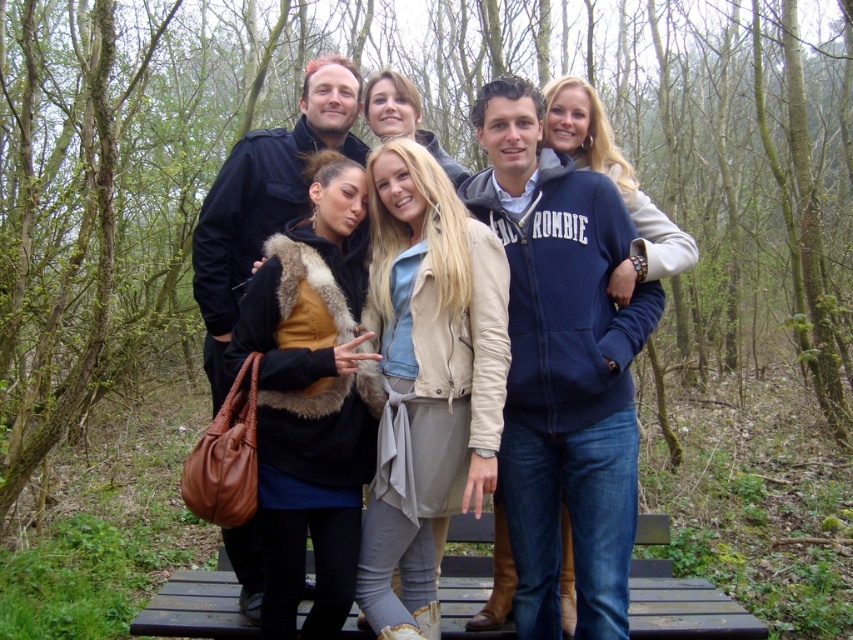
Question: Which point is closer to the camera taking this photo?

Choices:
 (A) (192, 588)
 (B) (292, 131)

Answer: (A)

Question: Does matte black jacket at center have a smaller size compared to black wood bench at center?

Choices:
 (A) yes
 (B) no

Answer: (B)

Question: Does matte black jacket at center appear on the left side of black wood bench at center?

Choices:
 (A) no
 (B) yes

Answer: (B)

Question: Is matte black jacket at center above black wood bench at center?

Choices:
 (A) no
 (B) yes

Answer: (B)